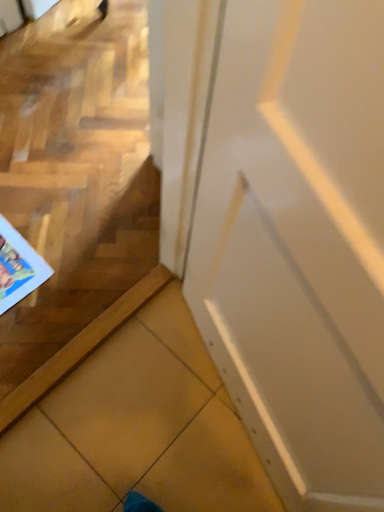
The height and width of the screenshot is (512, 384). I want to click on vacant space behind matte paper comic book at lower left, so click(x=39, y=202).